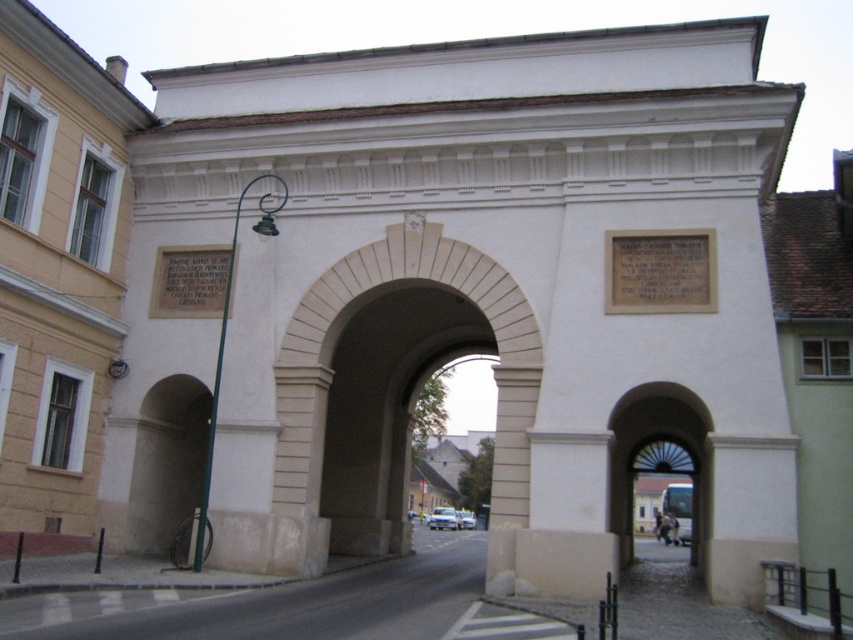
Does point (350, 490) come in front of point (671, 451)?

That is True.

Is white stone archway at center below matte glass door at center?

Incorrect, white stone archway at center is not positioned below matte glass door at center.

Which is in front, point (345, 408) or point (637, 508)?

Point (345, 408) is in front.

This screenshot has width=853, height=640. In order to click on white stone archway at center in this screenshot , I will do `click(389, 388)`.